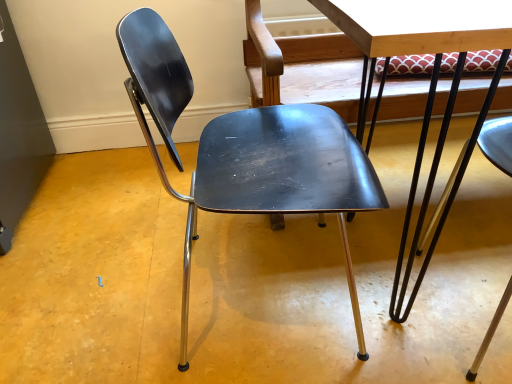
Question: Looking at their shapes, would you say matte black chair at center is wider or thinner than metallic/smooth table at center?

Choices:
 (A) wide
 (B) thin

Answer: (B)

Question: From the image's perspective, is matte black chair at center above or below metallic/smooth table at center?

Choices:
 (A) below
 (B) above

Answer: (A)

Question: Is point (185, 89) closer or farther from the camera than point (397, 271)?

Choices:
 (A) closer
 (B) farther

Answer: (A)

Question: From the image's perspective, is metallic/smooth table at center above or below matte black chair at center?

Choices:
 (A) below
 (B) above

Answer: (B)

Question: Is point (354, 6) closer or farther from the camera than point (202, 182)?

Choices:
 (A) farther
 (B) closer

Answer: (B)

Question: From their relative heights in the image, would you say metallic/smooth table at center is taller or shorter than matte black chair at center?

Choices:
 (A) short
 (B) tall

Answer: (B)

Question: Considering their positions, is metallic/smooth table at center located in front of or behind matte black chair at center?

Choices:
 (A) behind
 (B) front

Answer: (B)